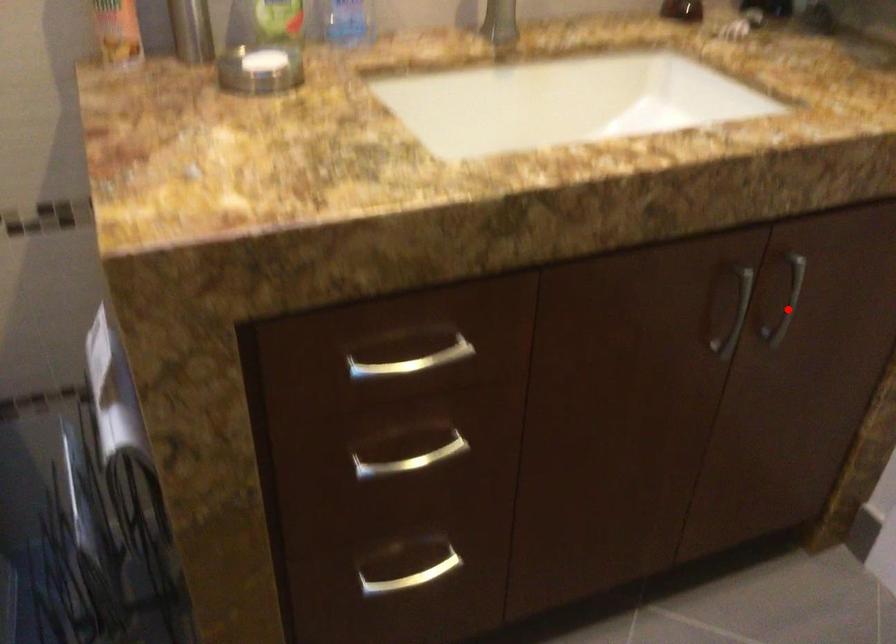
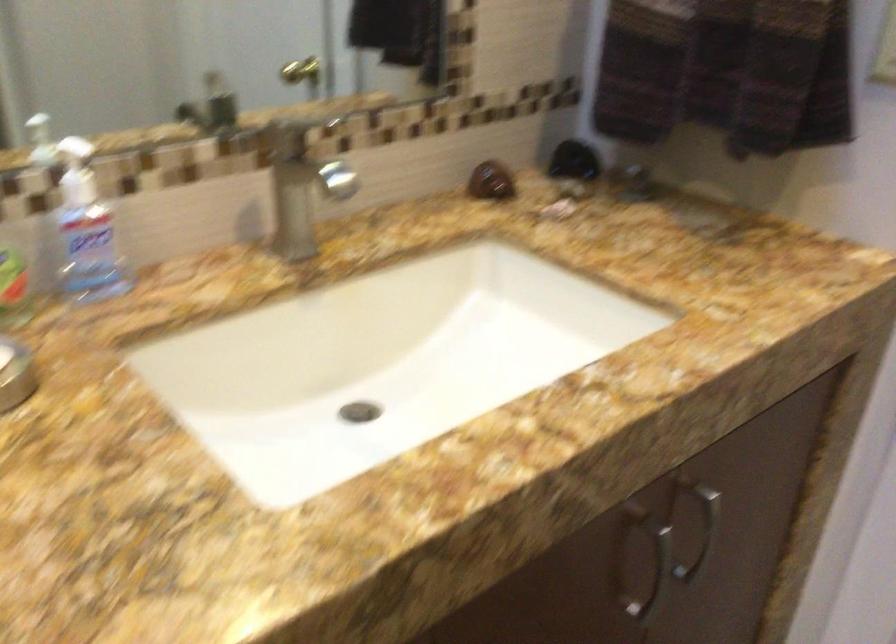
In the second image, find the point that corresponds to the highlighted location in the first image.

(702, 533)